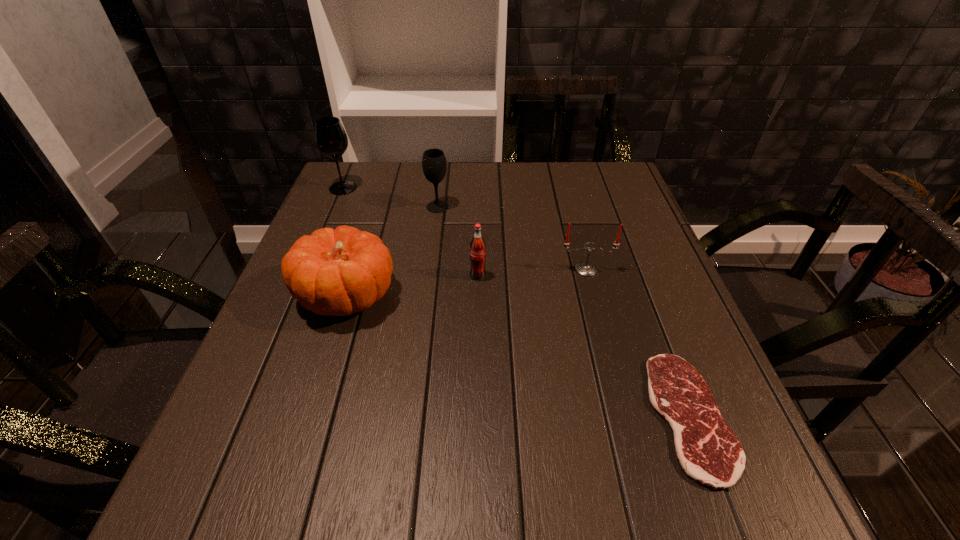
The width and height of the screenshot is (960, 540). I want to click on free space that satisfies the following two spatial constraints: 1. on the front side of the left wineglass; 2. on the left side of the steak, so click(246, 416).